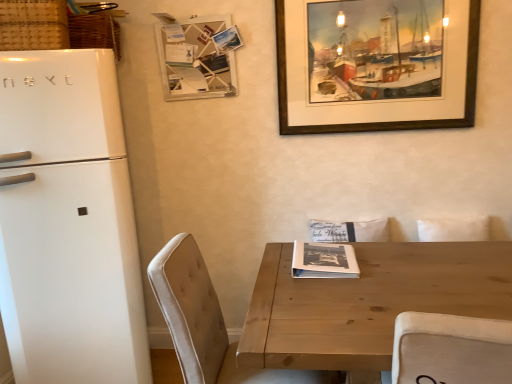
Question: In terms of size, does wooden picture frame at upper right appear bigger or smaller than beige fabric chair at lower left?

Choices:
 (A) big
 (B) small

Answer: (B)

Question: Is wooden picture frame at upper right wider or thinner than beige fabric chair at lower left?

Choices:
 (A) thin
 (B) wide

Answer: (A)

Question: Which object is the farthest from the wooden table at center?

Choices:
 (A) white matte refrigerator at left
 (B) wooden memo board at upper center
 (C) wooden picture frame at upper right
 (D) beige fabric chair at lower left
 (E) black paper magazine at center

Answer: (B)

Question: Which of these objects is positioned closest to the beige fabric chair at lower left?

Choices:
 (A) white matte refrigerator at left
 (B) wooden table at center
 (C) wooden memo board at upper center
 (D) black paper magazine at center
 (E) wooden picture frame at upper right

Answer: (B)